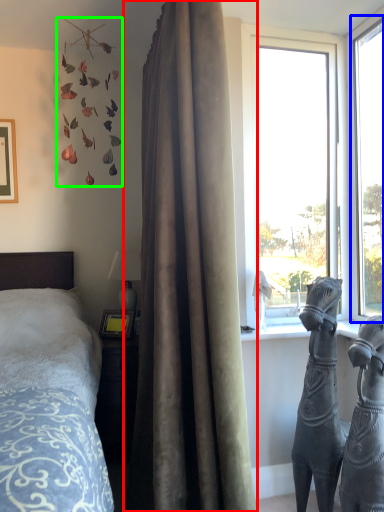
Question: Based on their relative distances, which object is nearer to curtain (highlighted by a red box)? Choose from window (highlighted by a blue box) and art (highlighted by a green box).

Choices:
 (A) window
 (B) art

Answer: (A)